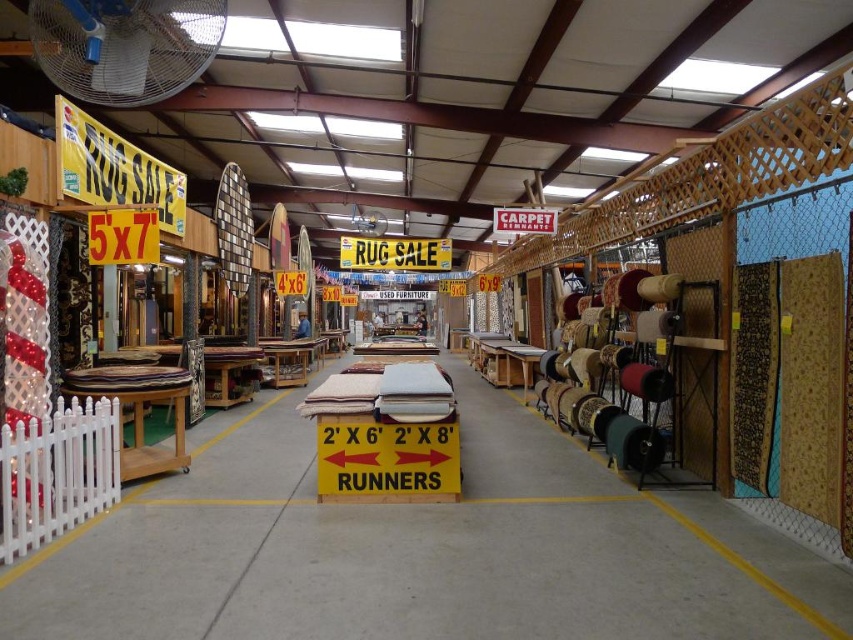
You are a delivery person entering the warehouse store and need to locate the white plastic fan at upper left. The store manager says it should be within 10 feet of your current position. Is the fan within the required distance?

The white plastic fan at upper left is 14.21 feet away from your current position, so it is beyond the 10 feet distance requirement set by the store manager.